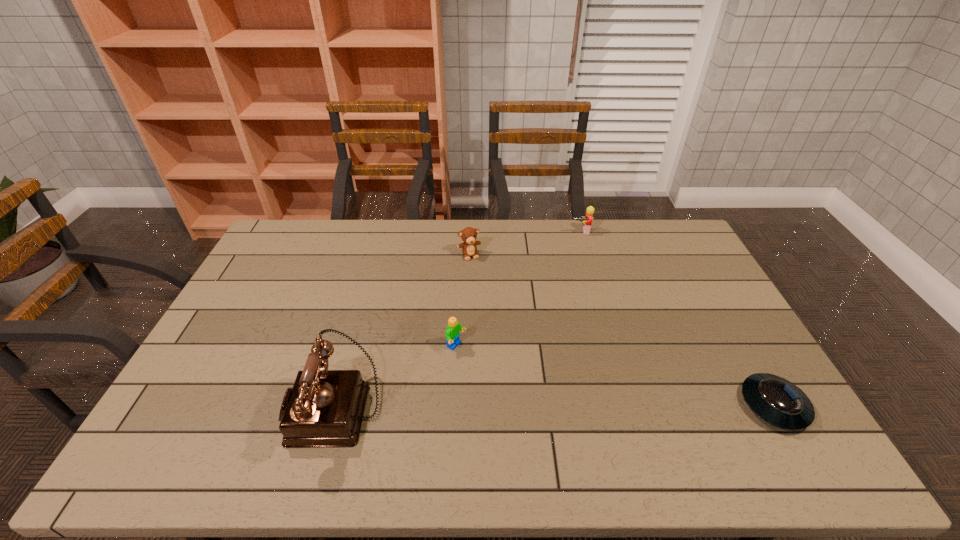
Locate an element on the screen. vacant space situated in front of the fourth object from left to right with the accessory visible is located at coordinates (588, 294).

I want to click on blank space located in front of the fourth object from left to right with the accessory visible, so click(x=583, y=250).

Find the location of `teddy bear positioned at the far edge`. teddy bear positioned at the far edge is located at coordinates (469, 234).

Locate an element on the screen. This screenshot has width=960, height=540. Lego at the far edge is located at coordinates (588, 218).

Identify the location of telephone positioned at the near edge. This screenshot has height=540, width=960. (325, 408).

At what (x,y) coordinates should I click in order to perform the action: click on saucer that is at the near edge. Please return your answer as a coordinate pair (x, y). Looking at the image, I should click on (779, 402).

Find the location of `object that is at the right edge`. object that is at the right edge is located at coordinates (779, 402).

The width and height of the screenshot is (960, 540). I want to click on object at the near right corner, so click(779, 402).

This screenshot has width=960, height=540. In order to click on vacant space at the far edge of the desktop in this screenshot , I will do `click(451, 242)`.

This screenshot has height=540, width=960. I want to click on vacant area at the left edge, so click(283, 306).